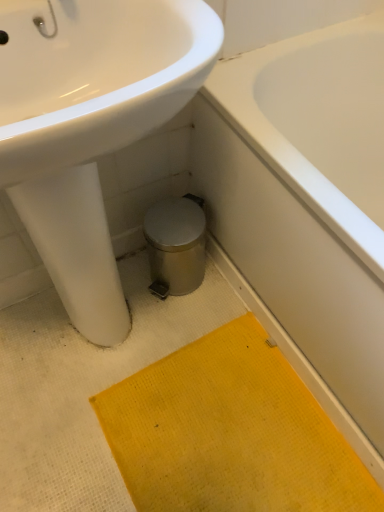
In order to face white glossy bathtub at lower right, should I rotate leftwards or rightwards?

A: Turn right by 24.978 degrees to look at white glossy bathtub at lower right.

I want to click on white glossy sink at upper left, so click(x=91, y=127).

From a real-world perspective, is yellow textured bath mat at lower center on top of white glossy bathtub at lower right?

Actually, yellow textured bath mat at lower center is physically below white glossy bathtub at lower right in the real world.

Between yellow textured bath mat at lower center and white glossy bathtub at lower right, which one is positioned behind?

Positioned behind is yellow textured bath mat at lower center.

Consider the image. Would you say yellow textured bath mat at lower center is outside white glossy bathtub at lower right?

Yes, yellow textured bath mat at lower center is not within white glossy bathtub at lower right.

From the image's perspective, which object appears higher, yellow textured bath mat at lower center or white glossy bathtub at lower right?

white glossy bathtub at lower right appears higher in the image.

Based on the photo, from a real-world perspective, relative to white glossy sink at upper left, is white glossy bathtub at lower right vertically above or below?

From a real-world perspective, white glossy bathtub at lower right is physically below white glossy sink at upper left.

Is white glossy bathtub at lower right next to white glossy sink at upper left and touching it?

No, white glossy bathtub at lower right is not touching white glossy sink at upper left.

Can you confirm if white glossy bathtub at lower right is thinner than white glossy sink at upper left?

In fact, white glossy bathtub at lower right might be wider than white glossy sink at upper left.

From the image's perspective, is white glossy bathtub at lower right positioned above or below yellow textured bath mat at lower center?

white glossy bathtub at lower right is above yellow textured bath mat at lower center.

Could you tell me if white glossy bathtub at lower right is facing yellow textured bath mat at lower center?

Yes.

Is the position of white glossy bathtub at lower right less distant than that of yellow textured bath mat at lower center?

Yes, white glossy bathtub at lower right is closer to the viewer.

Based on their sizes in the image, would you say white glossy bathtub at lower right is bigger or smaller than yellow textured bath mat at lower center?

In the image, white glossy bathtub at lower right appears to be larger than yellow textured bath mat at lower center.

Considering their positions, is white glossy sink at upper left located in front of or behind yellow textured bath mat at lower center?

white glossy sink at upper left is in front of yellow textured bath mat at lower center.

Are white glossy sink at upper left and yellow textured bath mat at lower center located far from each other?

No, white glossy sink at upper left is not far away from yellow textured bath mat at lower center.

Locate an element on the screen. The width and height of the screenshot is (384, 512). sink above the yellow textured bath mat at lower center (from the image's perspective) is located at coordinates (91, 127).

From the image's perspective, which is above, white glossy sink at upper left or yellow textured bath mat at lower center?

white glossy sink at upper left, from the image's perspective.

Which is behind, yellow textured bath mat at lower center or white glossy sink at upper left?

yellow textured bath mat at lower center.

Locate an element on the screen. bath mat behind the white glossy sink at upper left is located at coordinates (230, 433).

From the image's perspective, would you say yellow textured bath mat at lower center is shown under white glossy sink at upper left?

Yes, from the image's perspective, yellow textured bath mat at lower center is beneath white glossy sink at upper left.

Is yellow textured bath mat at lower center surrounding white glossy sink at upper left?

Actually, white glossy sink at upper left is outside yellow textured bath mat at lower center.

How many degrees apart are the facing directions of white glossy sink at upper left and white glossy bathtub at lower right?

The facing directions of white glossy sink at upper left and white glossy bathtub at lower right are 88.5 degrees apart.

Can you confirm if white glossy sink at upper left is positioned to the left of white glossy bathtub at lower right?

Yes, white glossy sink at upper left is to the left of white glossy bathtub at lower right.

Considering the relative sizes of white glossy sink at upper left and white glossy bathtub at lower right in the image provided, is white glossy sink at upper left taller than white glossy bathtub at lower right?

Yes.

Between point (75, 35) and point (203, 166), which one is positioned behind?

The point (203, 166) is farther.

This screenshot has width=384, height=512. Identify the location of bathtub located above the yellow textured bath mat at lower center (from the image's perspective). (306, 196).

Where is `sink below the white glossy bathtub at lower right (from the image's perspective)`? The width and height of the screenshot is (384, 512). sink below the white glossy bathtub at lower right (from the image's perspective) is located at coordinates (91, 127).

Considering their positions, is yellow textured bath mat at lower center positioned further to white glossy sink at upper left than white glossy bathtub at lower right?

The object further to white glossy sink at upper left is yellow textured bath mat at lower center.

Looking at the image, which one is located closer to white glossy bathtub at lower right, white glossy sink at upper left or yellow textured bath mat at lower center?

yellow textured bath mat at lower center is positioned closer to the anchor white glossy bathtub at lower right.

From the image, which object appears to be nearer to yellow textured bath mat at lower center, white glossy bathtub at lower right or white glossy sink at upper left?

white glossy bathtub at lower right lies closer to yellow textured bath mat at lower center than the other object.

Estimate the real-world distances between objects in this image. Which object is further from yellow textured bath mat at lower center, white glossy sink at upper left or white glossy bathtub at lower right?

Based on the image, white glossy sink at upper left appears to be further to yellow textured bath mat at lower center.

Based on their spatial positions, is white glossy bathtub at lower right or yellow textured bath mat at lower center closer to white glossy sink at upper left?

Based on the image, white glossy bathtub at lower right appears to be nearer to white glossy sink at upper left.

Based on their spatial positions, is yellow textured bath mat at lower center or white glossy sink at upper left further from white glossy bathtub at lower right?

white glossy sink at upper left lies further to white glossy bathtub at lower right than the other object.

At what (x,y) coordinates should I click in order to perform the action: click on bath mat between white glossy sink at upper left and white glossy bathtub at lower right. Please return your answer as a coordinate pair (x, y). Looking at the image, I should click on (230, 433).